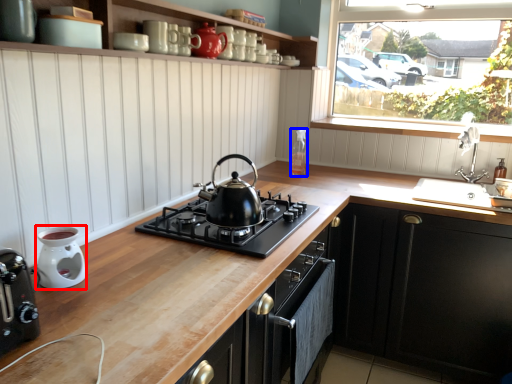
Question: Which object appears closest to the camera in this image, appliance (highlighted by a red box) or appliance (highlighted by a blue box)?

Choices:
 (A) appliance
 (B) appliance

Answer: (A)